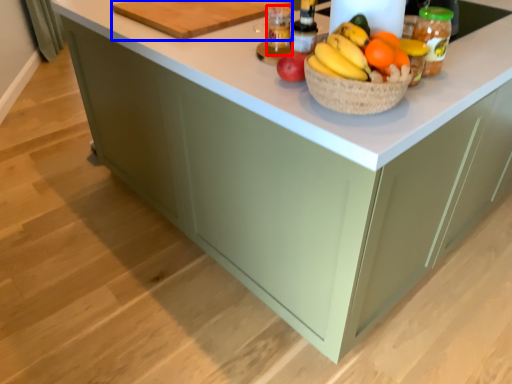
Question: Which object is closer to the camera taking this photo, bottle (highlighted by a red box) or cutting board (highlighted by a blue box)?

Choices:
 (A) bottle
 (B) cutting board

Answer: (A)